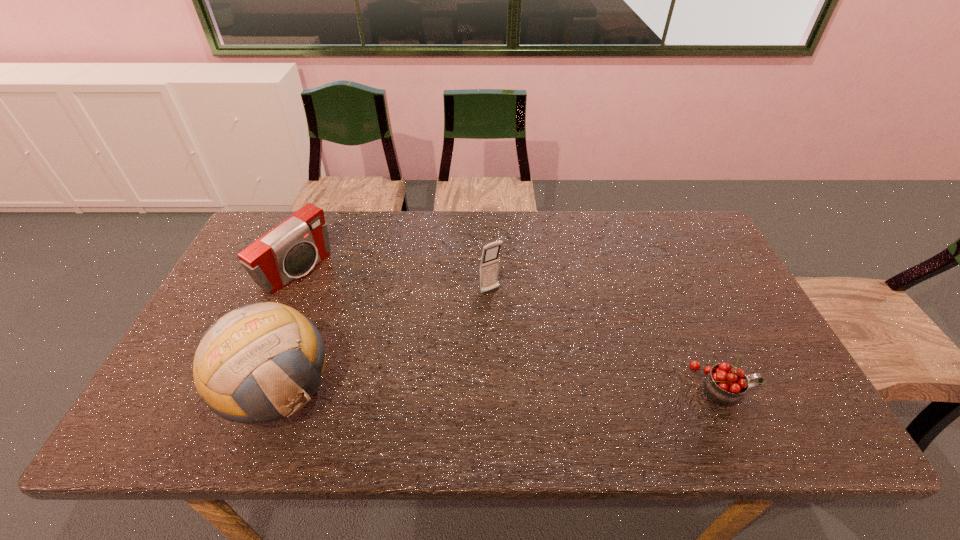
In order to click on vacant space on the desktop that is between the tallest object and the pot filled with cherries and is positioned on the front-facing side of the third object from left to right in this screenshot , I will do `click(560, 387)`.

The height and width of the screenshot is (540, 960). What are the coordinates of `vacant space on the desktop that is between the volleyball and the rightmost object and is positioned on the front-facing side of the camera` in the screenshot? It's located at (480, 388).